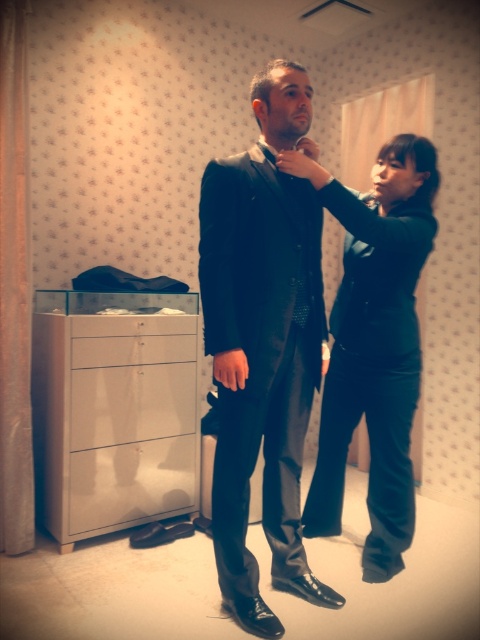
You are a tailor measuring a customer for a new suit. The customer is wearing the black shiny suit at center and velvet black pants at center. Which item has a narrower width?

The black shiny suit at center has a narrower width than the velvet black pants at center according to the description.